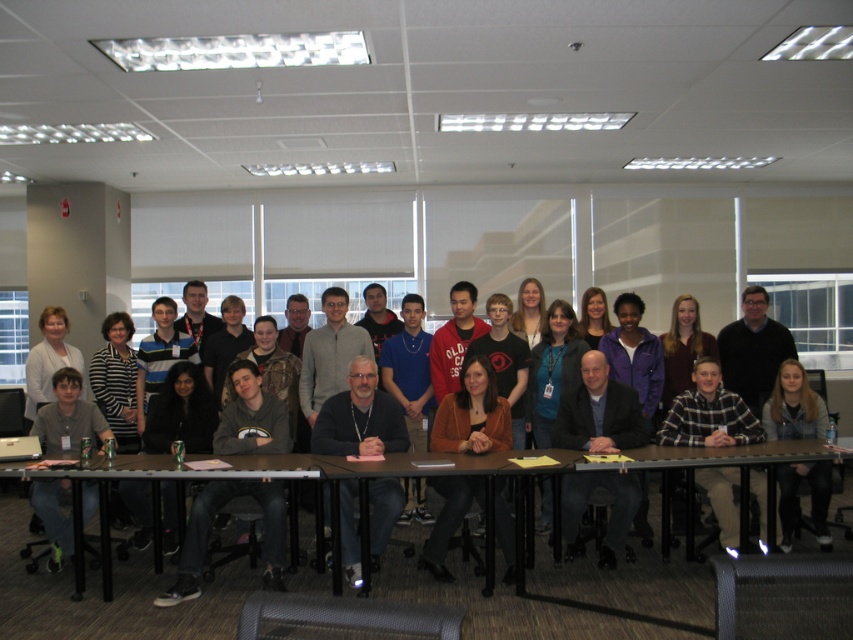
Is metallic gray table at center thinner than wooden table at center?

No, metallic gray table at center is not thinner than wooden table at center.

Identify the location of metallic gray table at center. The width and height of the screenshot is (853, 640). pyautogui.click(x=312, y=477).

Does wooden table at lower center have a lesser width compared to matte gray shirt at lower left?

Incorrect, wooden table at lower center's width is not less than matte gray shirt at lower left's.

Who is more distant from viewer, (109,468) or (84,520)?

Positioned behind is point (84,520).

Who is more forward, (x=164, y=476) or (x=96, y=502)?

Point (x=164, y=476) is in front.

This screenshot has height=640, width=853. Identify the location of wooden table at lower center. click(x=177, y=468).

Which is above, wooden table at lower center or light brown hair at lower right?

Positioned higher is light brown hair at lower right.

Measure the distance between wooden table at lower center and light brown hair at lower right.

wooden table at lower center is 3.06 meters away from light brown hair at lower right.

Find the location of a particular element. The height and width of the screenshot is (640, 853). wooden table at lower center is located at coordinates (177, 468).

Locate an element on the screen. The width and height of the screenshot is (853, 640). wooden table at lower center is located at coordinates (177, 468).